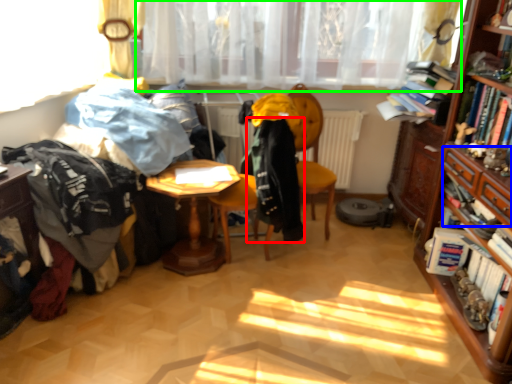
Question: Estimate the real-world distances between objects in this image. Which object is farther from clothing (highlighted by a red box), drawer (highlighted by a blue box) or curtain (highlighted by a green box)?

Choices:
 (A) drawer
 (B) curtain

Answer: (A)